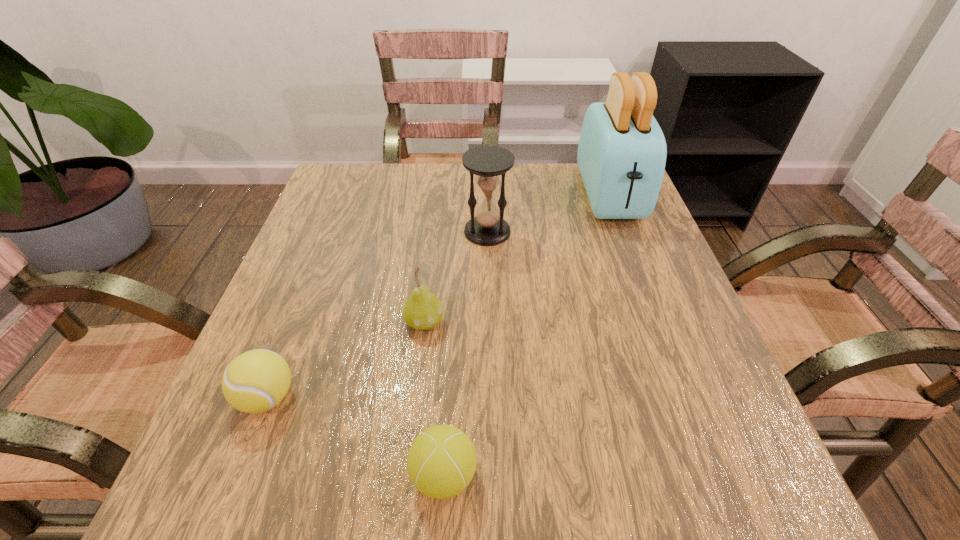
You are a GUI agent. You are given a task and a screenshot of the screen. Output one action in this format:
    pyautogui.click(x=<x>, y=<y>)
    Task: Click on the vacant position at the near edge of the desktop
    The width and height of the screenshot is (960, 540).
    Given the screenshot: What is the action you would take?
    pyautogui.click(x=605, y=461)

Locate an element on the screen. The height and width of the screenshot is (540, 960). blank space at the left edge of the desktop is located at coordinates (278, 428).

The width and height of the screenshot is (960, 540). In order to click on vacant space at the right edge of the desktop in this screenshot , I will do `click(590, 219)`.

Where is `vacant space at the far left corner`? This screenshot has width=960, height=540. vacant space at the far left corner is located at coordinates (348, 187).

Image resolution: width=960 pixels, height=540 pixels. I want to click on vacant space at the near right corner of the desktop, so click(729, 449).

Where is `vacant area that lies between the tallest object and the second tallest object`? vacant area that lies between the tallest object and the second tallest object is located at coordinates (548, 213).

Image resolution: width=960 pixels, height=540 pixels. I want to click on vacant space that is in between the nearer tennis ball and the hourglass, so click(466, 353).

At what (x,y) coordinates should I click in order to perform the action: click on free space between the second nearest object and the fourth shortest object. Please return your answer as a coordinate pair (x, y). The width and height of the screenshot is (960, 540). Looking at the image, I should click on (377, 314).

This screenshot has width=960, height=540. Find the location of `blank region between the hourglass and the farther tennis ball`. blank region between the hourglass and the farther tennis ball is located at coordinates (377, 314).

This screenshot has width=960, height=540. I want to click on empty space that is in between the fourth shortest object and the toaster, so click(x=548, y=213).